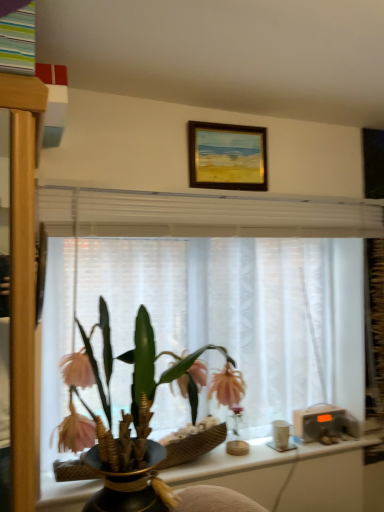
Consider the image. What is the approximate height of white sheer curtain at center?

white sheer curtain at center is 30.72 inches in height.

Measure the distance between white sheer curtain at center and camera.

white sheer curtain at center is 4.80 feet away from camera.

The height and width of the screenshot is (512, 384). Describe the element at coordinates (227, 156) in the screenshot. I see `gold-framed painting at upper center` at that location.

Describe the element at coordinates (280, 434) in the screenshot. I see `white matte cup at right` at that location.

Locate an element on the screen. transparent glass vase at center is located at coordinates (237, 447).

From a real-world perspective, is transparent glass vase at center beneath white sheer curtain at center?

Correct, in the physical world, transparent glass vase at center is lower than white sheer curtain at center.

From the image's perspective, does transparent glass vase at center appear higher than white sheer curtain at center?

No.

Locate an element on the screen. This screenshot has width=384, height=512. window frame on the left of transparent glass vase at center is located at coordinates (237, 289).

Is transparent glass vase at center facing away from white sheer curtain at center?

transparent glass vase at center is not turned away from white sheer curtain at center.

Image resolution: width=384 pixels, height=512 pixels. In order to click on coffee cup lying on the right of matte black vase at center in this screenshot , I will do point(280,434).

Is point (287, 422) closer to viewer compared to point (66, 430)?

No, it is behind (66, 430).

Considering the relative sizes of transparent glass vase at center and white matte cup at right in the image provided, is transparent glass vase at center shorter than white matte cup at right?

In fact, transparent glass vase at center may be taller than white matte cup at right.

Which object is positioned more to the right, transparent glass vase at center or white matte cup at right?

Positioned to the right is white matte cup at right.

I want to click on coffee cup located below the transparent glass vase at center (from the image's perspective), so click(280, 434).

Is the depth of transparent glass vase at center greater than that of white matte cup at right?

No, transparent glass vase at center is closer to the camera.

Is white matte cup at right further to the viewer compared to white sheer curtain at center?

Yes.

Is white matte cup at right to the left of white sheer curtain at center from the viewer's perspective?

In fact, white matte cup at right is to the right of white sheer curtain at center.

Does point (288, 433) appear closer or farther from the camera than point (254, 368)?

Point (288, 433) is positioned closer to the camera compared to point (254, 368).

Which of these two, transparent glass vase at center or gold-framed painting at upper center, stands taller?

With more height is gold-framed painting at upper center.

How distant is transparent glass vase at center from gold-framed painting at upper center?

They are 3.75 feet apart.

Which is in front, point (236, 452) or point (226, 130)?

The point (226, 130) is more forward.

Considering the relative sizes of transparent glass vase at center and gold-framed painting at upper center in the image provided, is transparent glass vase at center smaller than gold-framed painting at upper center?

Indeed, transparent glass vase at center has a smaller size compared to gold-framed painting at upper center.

Does white matte cup at right have a lesser width compared to gold-framed painting at upper center?

Incorrect, the width of white matte cup at right is not less than that of gold-framed painting at upper center.

Which is farther, (277, 422) or (212, 161)?

Point (277, 422)

How many degrees apart are the facing directions of matte black vase at center and gold-framed painting at upper center?

90 degrees.

Is point (135, 429) positioned behind point (209, 156)?

That is False.

Which of these two, matte black vase at center or gold-framed painting at upper center, stands shorter?

With less height is gold-framed painting at upper center.

Where is `houseplant beneath the gold-framed painting at upper center (from a real-world perspective)`? The image size is (384, 512). houseplant beneath the gold-framed painting at upper center (from a real-world perspective) is located at coordinates (131, 421).

In the image, there is a white sheer curtain at center. Identify the location of glass vase below it (from a real-world perspective). This screenshot has height=512, width=384. (237, 447).

At what (x,y) coordinates should I click in order to perform the action: click on houseplant above the white matte cup at right (from a real-world perspective). Please return your answer as a coordinate pair (x, y). Looking at the image, I should click on click(x=131, y=421).

Estimate the real-world distances between objects in this image. Which object is closer to white sheer curtain at center, matte black vase at center or transparent glass vase at center?

matte black vase at center is closer to white sheer curtain at center.

Looking at this image, from the image, which object appears to be farther from matte black vase at center, transparent glass vase at center or white sheer curtain at center?

transparent glass vase at center is further to matte black vase at center.

Looking at the image, which one is located further to gold-framed painting at upper center, white matte cup at right or transparent glass vase at center?

Based on the image, white matte cup at right appears to be further to gold-framed painting at upper center.

Based on their spatial positions, is matte black vase at center or white sheer curtain at center closer to white matte cup at right?

white sheer curtain at center lies closer to white matte cup at right than the other object.

Looking at the image, which one is located closer to white sheer curtain at center, transparent glass vase at center or matte black vase at center?

matte black vase at center.

From the image, which object appears to be nearer to white matte cup at right, gold-framed painting at upper center or transparent glass vase at center?

transparent glass vase at center is positioned closer to the anchor white matte cup at right.

When comparing their distances from transparent glass vase at center, does white sheer curtain at center or matte black vase at center seem closer?

white sheer curtain at center lies closer to transparent glass vase at center than the other object.

Which object lies nearer to the anchor point gold-framed painting at upper center, white matte cup at right or matte black vase at center?

Based on the image, matte black vase at center appears to be nearer to gold-framed painting at upper center.

Identify the location of window frame between gold-framed painting at upper center and transparent glass vase at center vertically. (237, 289).

Where is `houseplant between gold-framed painting at upper center and white matte cup at right from top to bottom`? The height and width of the screenshot is (512, 384). houseplant between gold-framed painting at upper center and white matte cup at right from top to bottom is located at coordinates pos(131,421).

Where is `window frame between matte black vase at center and transparent glass vase at center in the front-back direction`? The image size is (384, 512). window frame between matte black vase at center and transparent glass vase at center in the front-back direction is located at coordinates (237, 289).

Identify the location of window frame located between matte black vase at center and white matte cup at right in the depth direction. (237, 289).